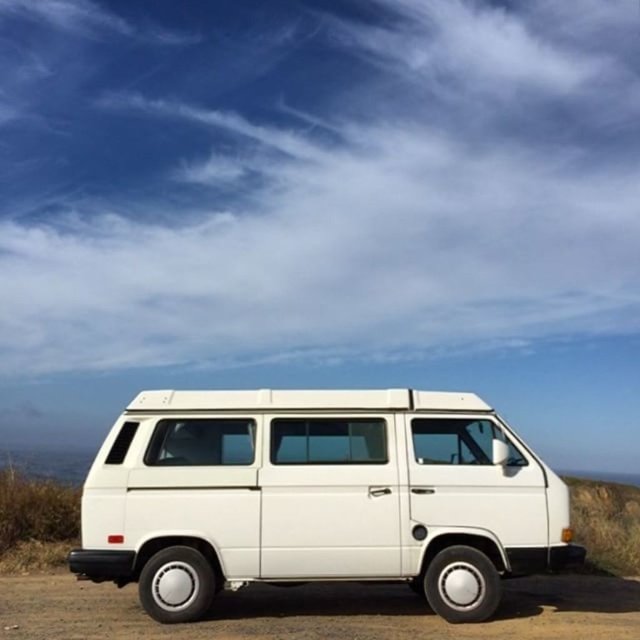
You are a photographer planning to take a picture of the white matte van at center and the white rubber tire at lower center. Based on their sizes in the image, which object should you focus on first if you want to capture both in a single frame without zooming in or out?

The white matte van at center is smaller than the white rubber tire at lower center, so you should focus on the white rubber tire at lower center first to ensure it fits properly in the frame since it is larger.